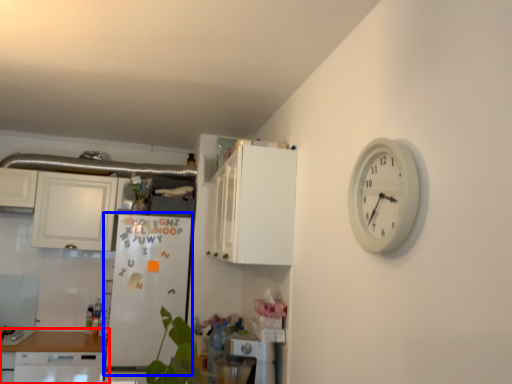
Question: Among these objects, which one is nearest to the camera, home appliance (highlighted by a red box) or fridge (highlighted by a blue box)?

Choices:
 (A) home appliance
 (B) fridge

Answer: (A)